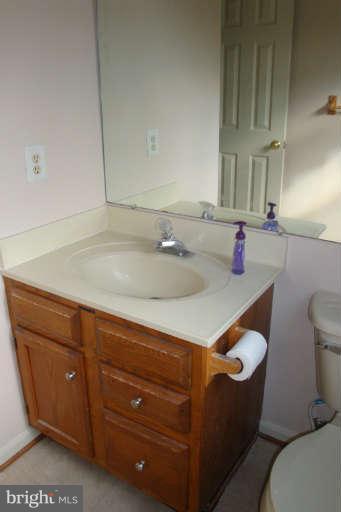
The width and height of the screenshot is (341, 512). In order to click on reflection of socket in this screenshot , I will do `click(155, 149)`, `click(153, 138)`.